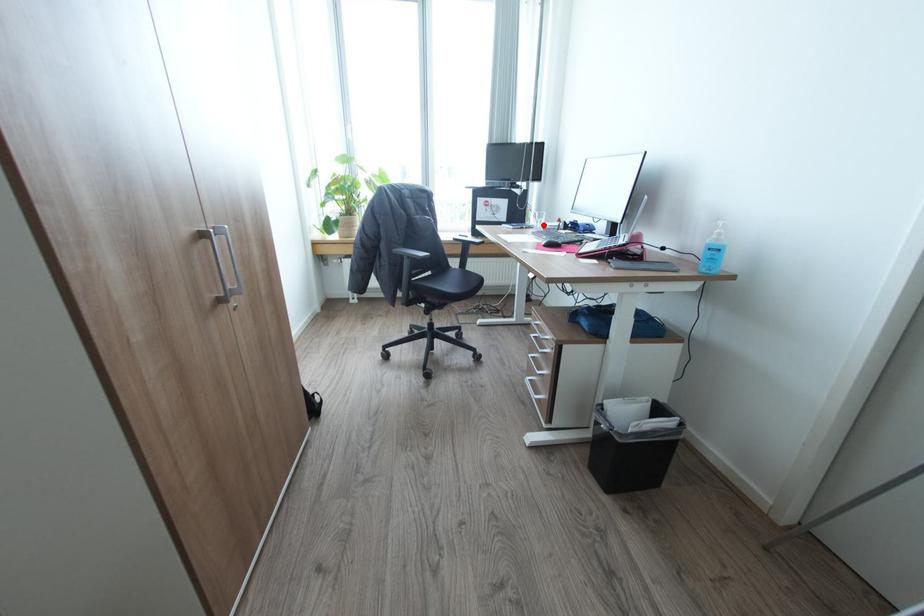
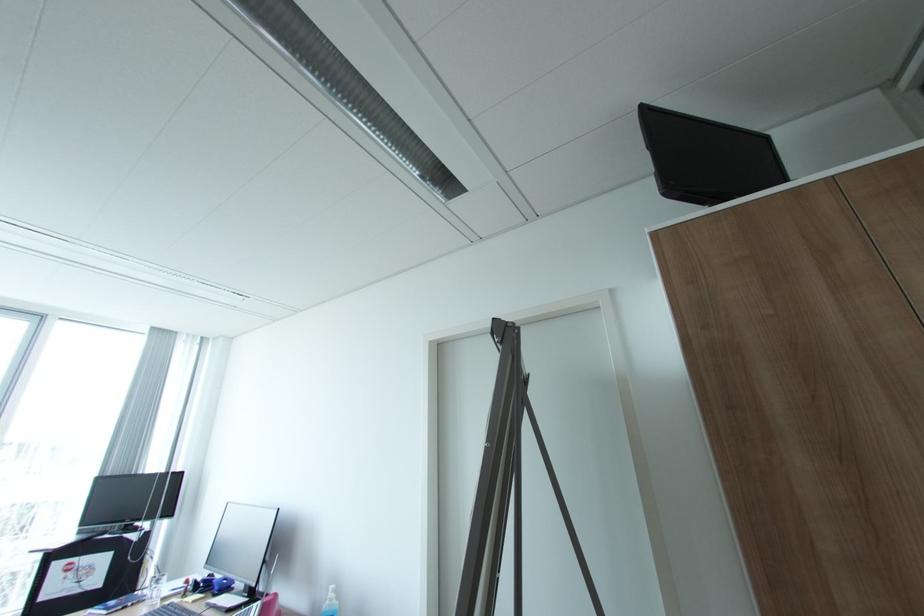
Question: I am providing you with two images of the same scene from different viewpoints. Given a red point in image1, look at the same physical point in image2. Is it:

Choices:
 (A) Closer to the viewpoint
 (B) Farther from the viewpoint

Answer: (A)